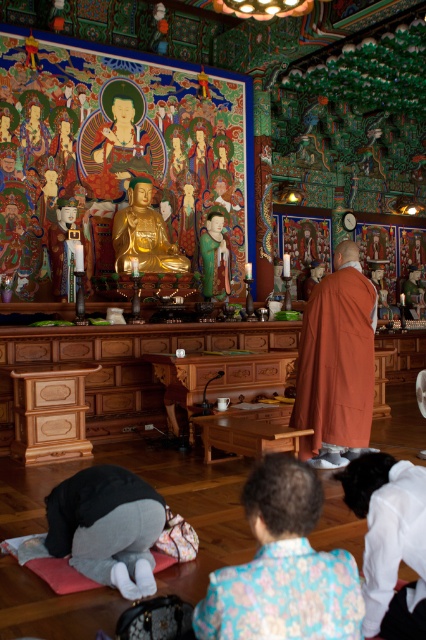
Is point (319, 333) closer to camera compared to point (391, 509)?

That is False.

Who is positioned more to the right, orange cotton robe at center or white matte robe at lower center?

From the viewer's perspective, orange cotton robe at center appears more on the right side.

Does point (305, 451) come behind point (359, 480)?

That is True.

At what (x,y) coordinates should I click in order to perform the action: click on orange cotton robe at center. Please return your answer as a coordinate pair (x, y). The height and width of the screenshot is (640, 426). Looking at the image, I should click on (336, 362).

Can you confirm if floral silk robe at lower center is taller than white matte robe at lower center?

No, floral silk robe at lower center is not taller than white matte robe at lower center.

Between floral silk robe at lower center and white matte robe at lower center, which one appears on the left side from the viewer's perspective?

From the viewer's perspective, floral silk robe at lower center appears more on the left side.

The width and height of the screenshot is (426, 640). What are the coordinates of `floral silk robe at lower center` in the screenshot? It's located at (284, 595).

Does point (333, 637) come farther from viewer compared to point (354, 417)?

No, (333, 637) is in front of (354, 417).

Is floral silk robe at lower center thinner than orange cotton robe at center?

Indeed, floral silk robe at lower center has a lesser width compared to orange cotton robe at center.

Between point (299, 620) and point (316, 397), which one is positioned in front?

Positioned in front is point (299, 620).

Image resolution: width=426 pixels, height=640 pixels. Identify the location of floral silk robe at lower center. (284, 595).